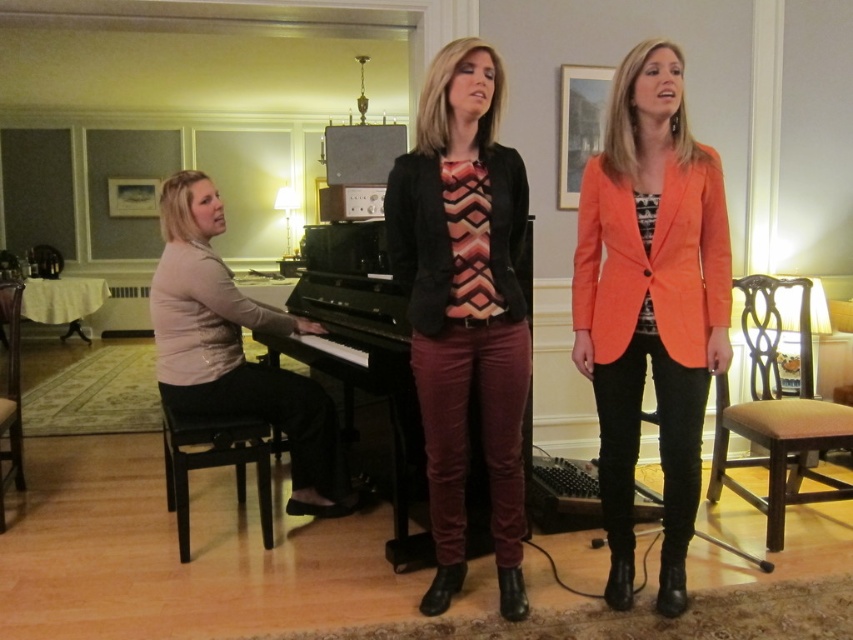
You are a tailor trying to fit a new customer. You have two garments in front of you, the orange fabric blazer at center and the matte beige sweater at left. The customer says they want the wider garment. Which one should you choose?

The matte beige sweater at left is wider than the orange fabric blazer at center, so you should choose the matte beige sweater at left.

You are a musician who wants to sit on the black wood stool at lower left to play the black polished piano at center. Can you reach the piano from your current position on the stool?

The black polished piano at center is to the right of the black wood stool at lower left, so yes, you can reach the piano from the stool by moving to the right.